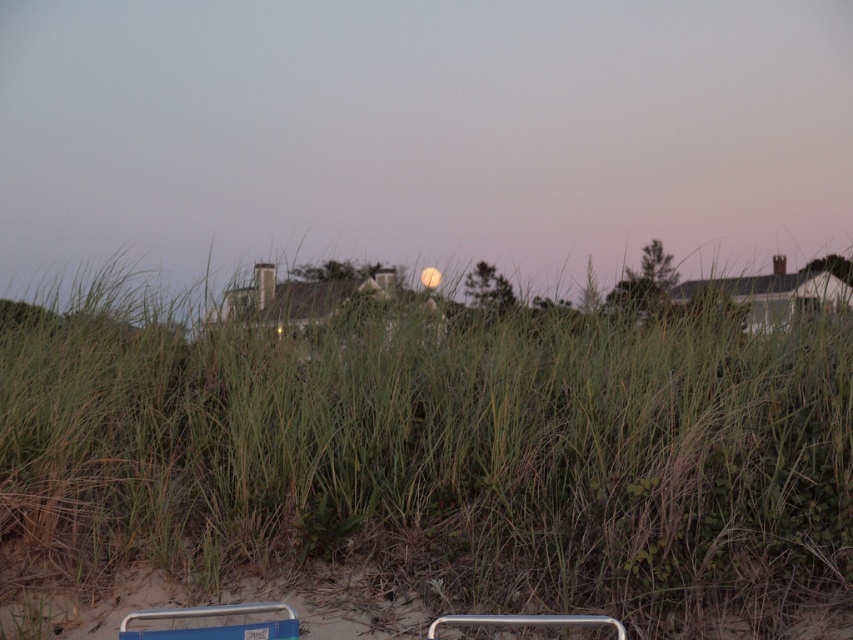
You are standing at the point marked as point (438, 456) in the image. What do you see directly in front of you?

You see green grass at center directly in front of you at point (438, 456).

You are standing on the sandy area and looking towards the green grass at center and the metallic silver rail at lower center. Which object is closer to your feet?

The metallic silver rail at lower center is closer to your feet because it is positioned below the green grass at center.

You are standing at the center of the sandy area and want to place a small garden ornament exactly where the green grass at center is located. What are the coordinates where you should place it?

The coordinates for the green grass at center are 0.714 on the x axis and 0.515 on the y axis.